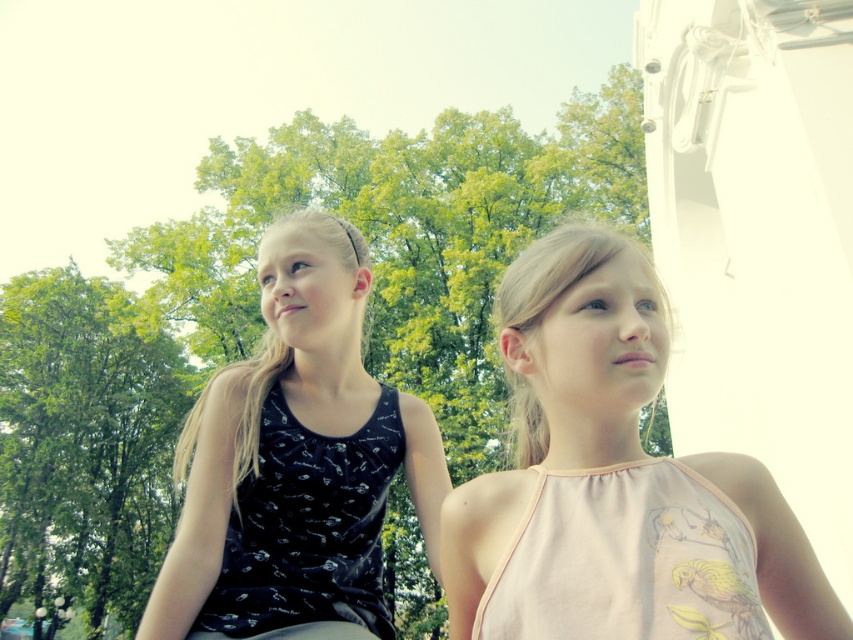
Question: Among these objects, which one is farthest from the camera?

Choices:
 (A) pink fabric dress at center
 (B) black matte tank top at left

Answer: (B)

Question: Can you confirm if black matte tank top at left is positioned below pink fabric dress at center?

Choices:
 (A) no
 (B) yes

Answer: (B)

Question: Which of the following is the farthest from the observer?

Choices:
 (A) [518, 442]
 (B) [442, 461]

Answer: (B)

Question: Does black matte tank top at left appear on the left side of pink fabric dress at center?

Choices:
 (A) yes
 (B) no

Answer: (A)

Question: From the image, what is the correct spatial relationship of black matte tank top at left in relation to pink fabric dress at center?

Choices:
 (A) above
 (B) below

Answer: (B)